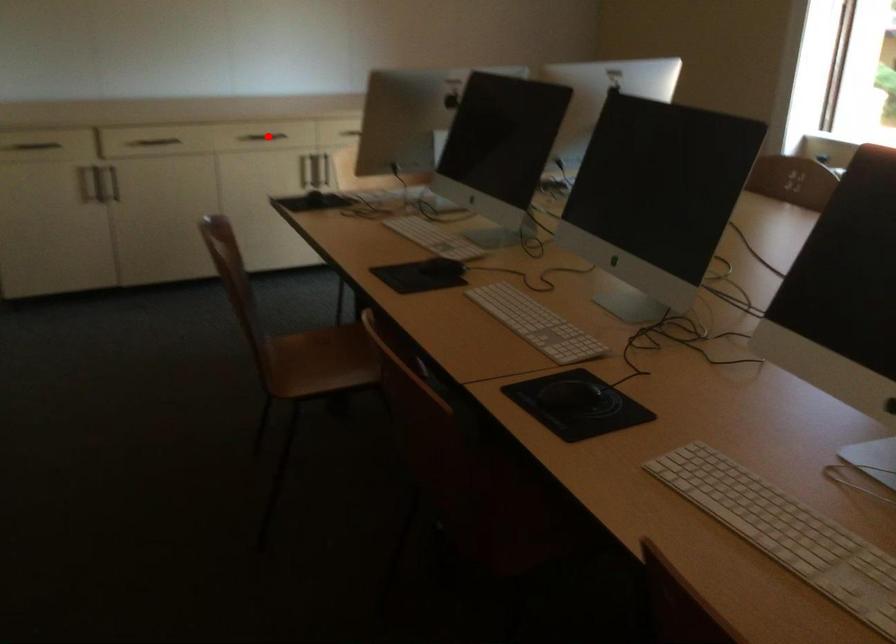
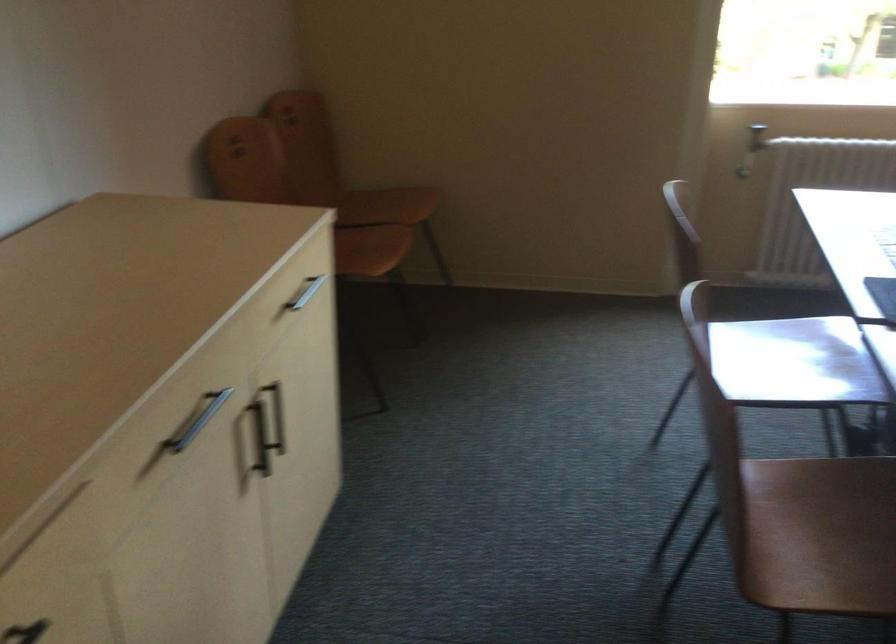
The point at the highlighted location is marked in the first image. Where is the corresponding point in the second image?

(197, 420)